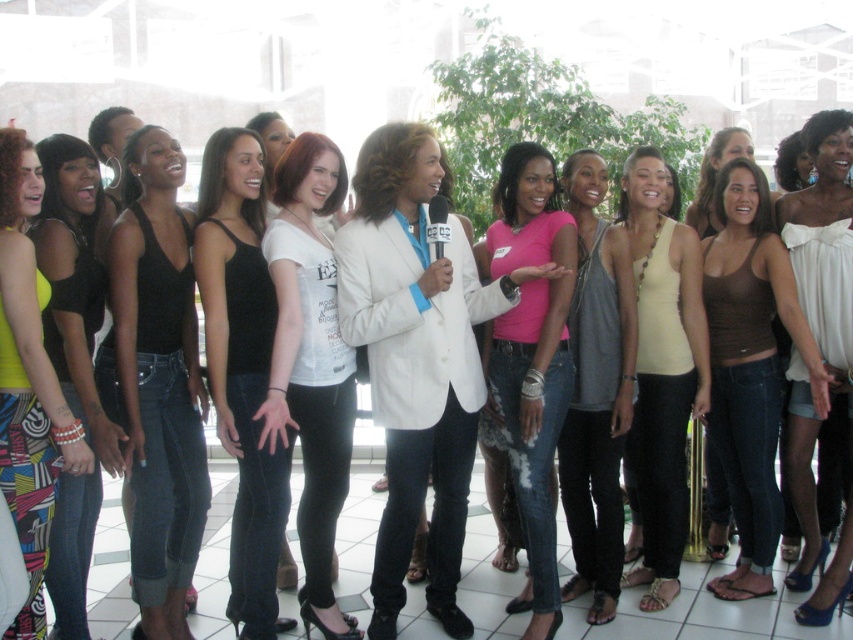
Is matte black tank top at center closer to camera compared to gray cotton tank top at center?

Yes, matte black tank top at center is in front of gray cotton tank top at center.

Can you confirm if matte black tank top at center is positioned below gray cotton tank top at center?

Correct, matte black tank top at center is located below gray cotton tank top at center.

Describe the element at coordinates (160, 381) in the screenshot. The height and width of the screenshot is (640, 853). I see `matte black tank top at center` at that location.

The width and height of the screenshot is (853, 640). I want to click on matte black tank top at center, so click(x=160, y=381).

Does brown matte tank top at center appear over light yellow tank top at center?

Yes.

I want to click on brown matte tank top at center, so click(750, 365).

The height and width of the screenshot is (640, 853). In order to click on brown matte tank top at center in this screenshot , I will do `click(750, 365)`.

Who is shorter, black denim jeans at center or brown matte tank top at center?

brown matte tank top at center

Measure the distance between black denim jeans at center and brown matte tank top at center.

black denim jeans at center and brown matte tank top at center are 26.63 feet apart from each other.

The height and width of the screenshot is (640, 853). Describe the element at coordinates (241, 368) in the screenshot. I see `black denim jeans at center` at that location.

What are the coordinates of `black denim jeans at center` in the screenshot? It's located at coord(241,368).